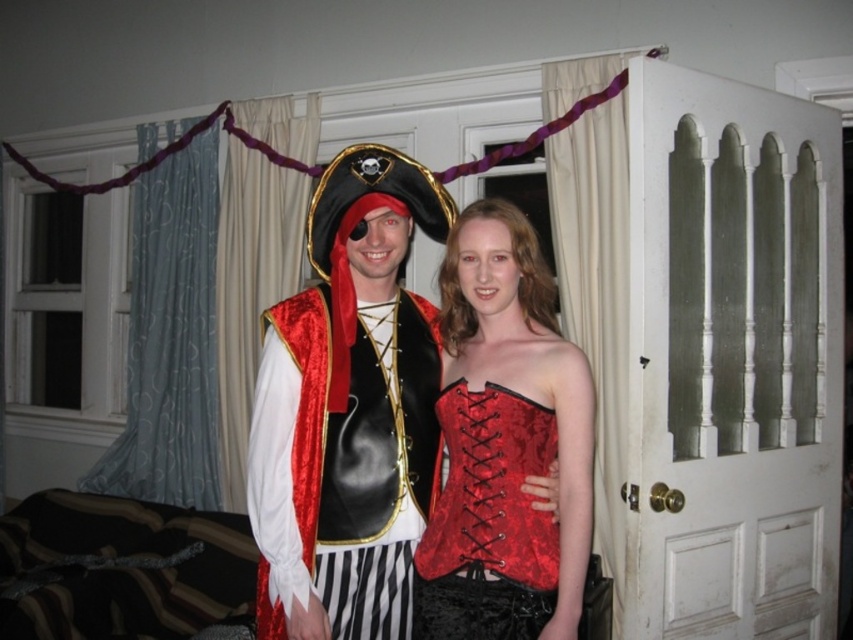
You are a costume designer trying to layer two corsets for a pirate costume. You have the velvet red corset at center and the red velvet corset at center. According to the image, which corset is placed on top?

The velvet red corset at center is placed on top of the red velvet corset at center as per the description.

You are trying to decide which corset to wear for a costume party. You see the velvet red corset at center and the red velvet corset at center in the image. Which one is wider?

The velvet red corset at center is wider than the red velvet corset at center according to the description.